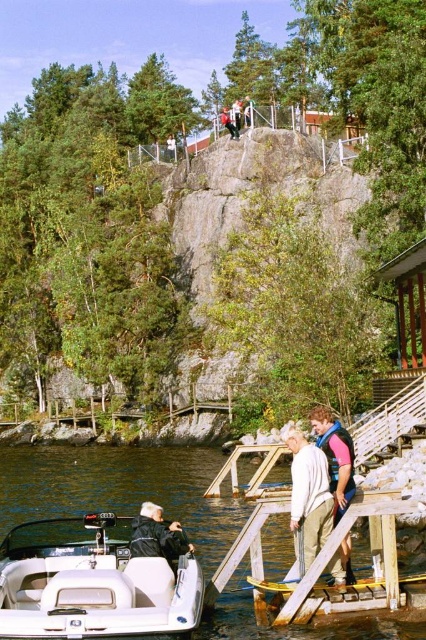
Question: Does white matte boat at lower left appear on the left side of clear water at lower left?

Choices:
 (A) yes
 (B) no

Answer: (B)

Question: Is wooden at lower center closer to the viewer compared to black leather jacket at lower center?

Choices:
 (A) yes
 (B) no

Answer: (B)

Question: Which object is farther from the camera taking this photo?

Choices:
 (A) white matte boat at lower left
 (B) white cotton shirt at center
 (C) clear water at lower left
 (D) wooden at lower center

Answer: (B)

Question: Which object appears farthest from the camera in this image?

Choices:
 (A) white matte boat at lower left
 (B) black leather jacket at lower center

Answer: (B)

Question: Can you confirm if white cotton shirt at center is bigger than matte black jacket at upper center?

Choices:
 (A) no
 (B) yes

Answer: (A)

Question: Estimate the real-world distances between objects in this image. Which object is closer to the clear water at lower left?

Choices:
 (A) black leather jacket at lower center
 (B) white matte boat at lower left
 (C) wooden at lower center

Answer: (B)